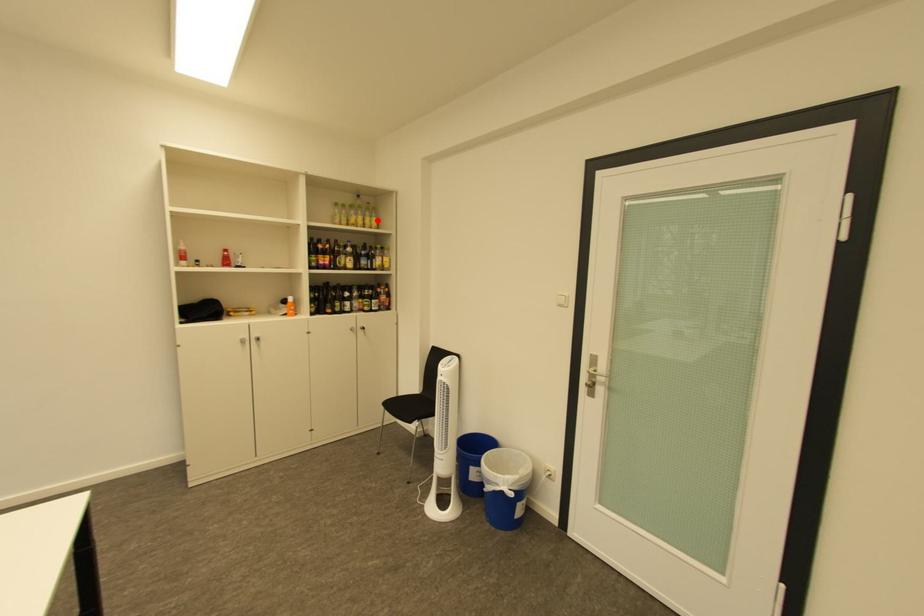
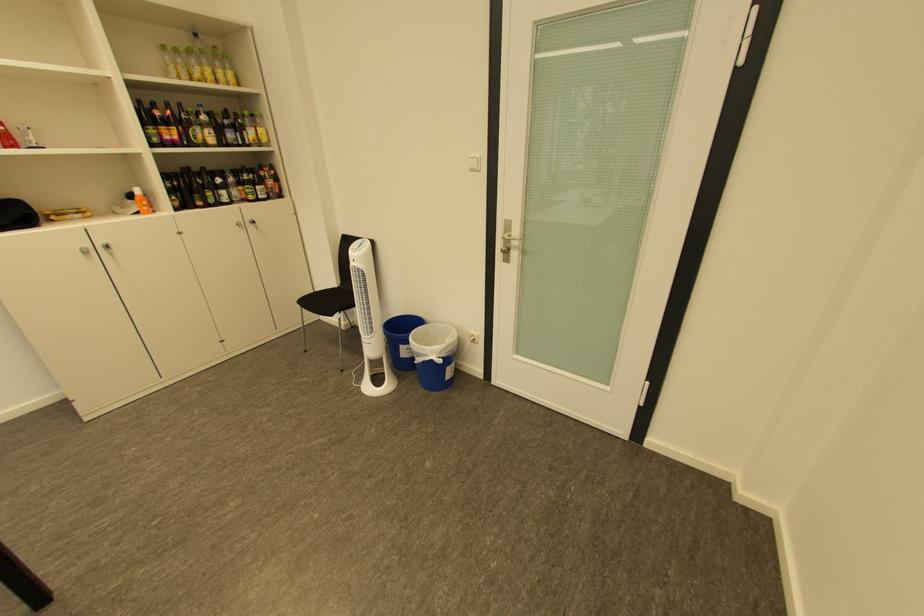
Question: I am providing you with two images of the same scene from different viewpoints. Image1 has a red point marked. In image2, the corresponding 3D location appears at what relative position? Reply with the corresponding letter.

Choices:
 (A) Closer
 (B) Farther

Answer: (B)